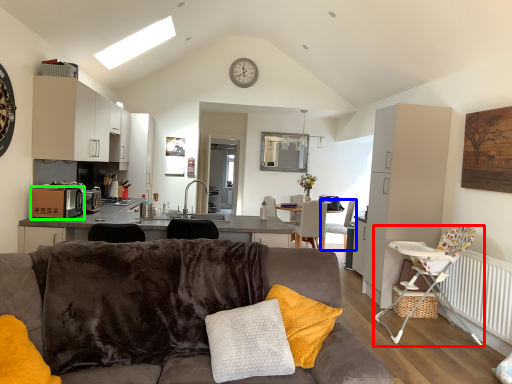
Question: Considering the real-world distances, which object is closest to chair (highlighted by a red box)? chair (highlighted by a blue box) or kitchen appliance (highlighted by a green box).

Choices:
 (A) chair
 (B) kitchen appliance

Answer: (A)